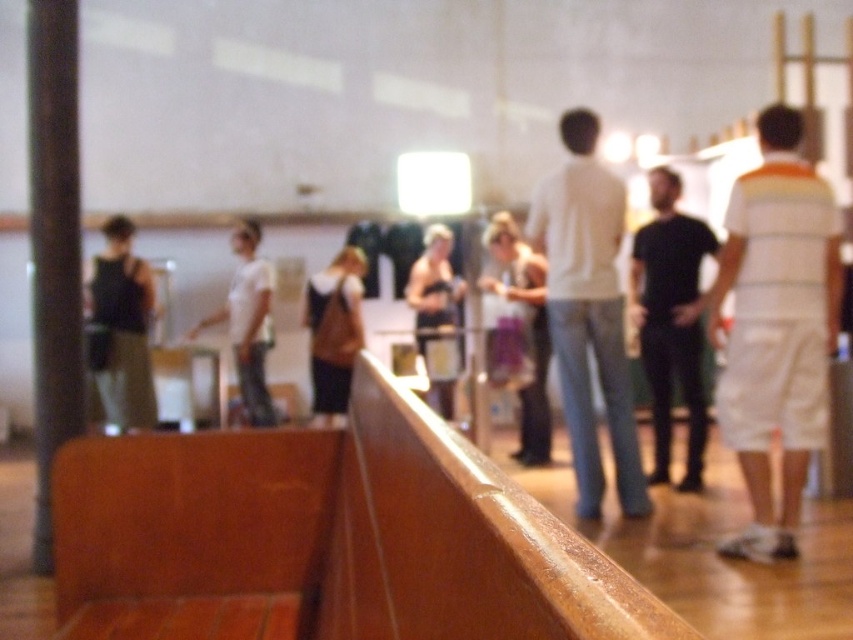
You are standing at the center of the room and want to find the white matte shirt at center. Based on the coordinates given, in which direction should you look to locate it?

The white matte shirt at center is located at coordinates point (x=589, y=310), so you should look slightly to your lower right from the center point to locate it.

You are at an event and need to locate the person wearing the black matte shirt at center. Where would you look relative to the brown leather bag at center?

The black matte shirt at center is to the right of the brown leather bag at center, so you should look to the right side of the brown leather bag at center to find the person wearing it.

You are standing at the center of the scene and want to locate the white striped shirt at right. According to the coordinates given, in which direction should you turn to face it?

The white striped shirt at right is located at coordinates point (776, 326). Since you are at the center, you should turn to your right to face it.